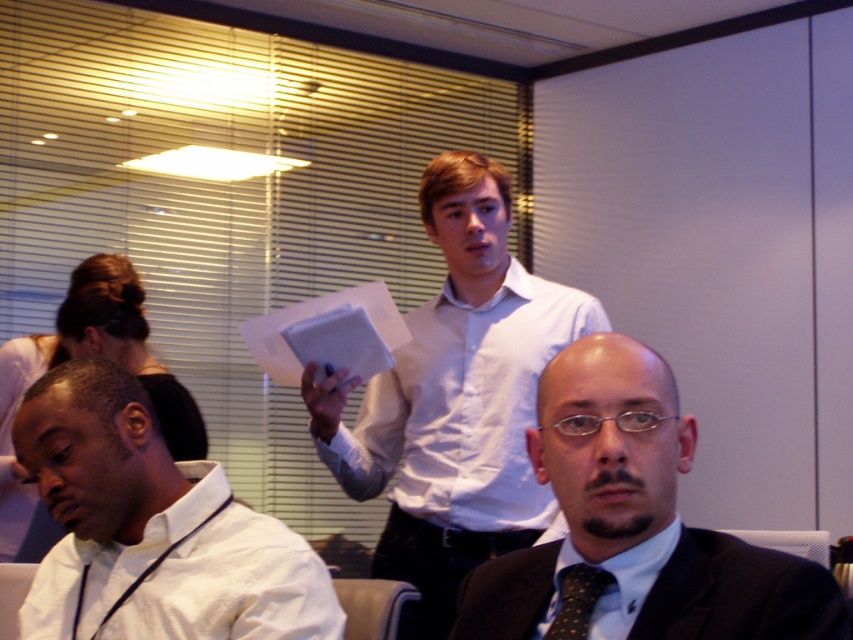
Question: Estimate the real-world distances between objects in this image. Which object is closer to the white shirt at lower left?

Choices:
 (A) white textured shirt at center
 (B) white paper at center

Answer: (A)

Question: Where is white shirt at lower left located in relation to polka dot silk tie at center in the image?

Choices:
 (A) left
 (B) right

Answer: (A)

Question: Which of the following is the farthest from the observer?

Choices:
 (A) (93, 515)
 (B) (469, 616)
 (C) (397, 545)
 (D) (563, 618)

Answer: (C)

Question: Can you confirm if white textured shirt at center is thinner than polka dot silk tie at center?

Choices:
 (A) no
 (B) yes

Answer: (A)

Question: Which is farther from the polka dot silk tie at center?

Choices:
 (A) dark suit at center
 (B) white shirt at lower left
 (C) dark brown textured suit at lower right

Answer: (B)

Question: Observing the image, what is the correct spatial positioning of dark brown textured suit at lower right in reference to white paper at center?

Choices:
 (A) above
 (B) below

Answer: (B)